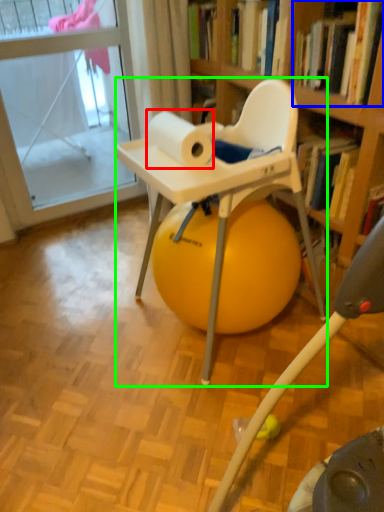
Question: Considering the real-world distances, which object is farthest from paper towel (highlighted by a red box)? book (highlighted by a blue box) or chair (highlighted by a green box)?

Choices:
 (A) book
 (B) chair

Answer: (A)